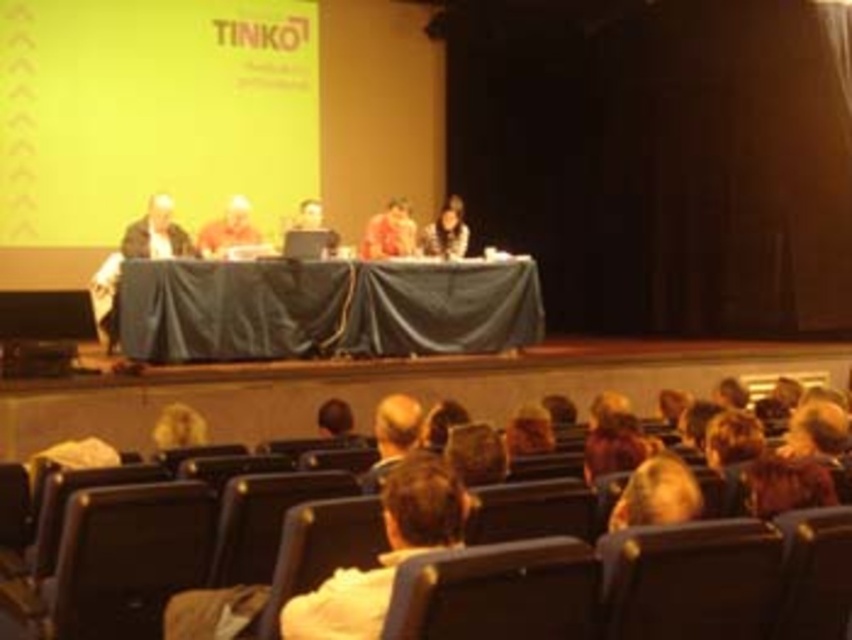
Question: Which point is closer to the camera?

Choices:
 (A) orange fabric at center
 (B) yellow matte projection screen at upper center
 (C) black leather chair at lower right
 (D) matte gold hair at center

Answer: (C)

Question: Which of the following is the farthest from the observer?

Choices:
 (A) matte black laptop at center
 (B) matte gold hair at center

Answer: (A)

Question: In this image, where is matte gold hair at center located relative to matte black laptop at center?

Choices:
 (A) above
 (B) below

Answer: (B)

Question: Which point is closer to the camera?

Choices:
 (A) yellow matte projection screen at upper center
 (B) matte gold hair at center
 (C) orange fabric at center
 (D) matte black laptop at center

Answer: (B)

Question: Considering the relative positions of yellow matte projection screen at upper center and black leather chair at lower right in the image provided, where is yellow matte projection screen at upper center located with respect to black leather chair at lower right?

Choices:
 (A) below
 (B) above

Answer: (B)

Question: Can you confirm if matte gold hair at center is positioned below matte black laptop at center?

Choices:
 (A) no
 (B) yes

Answer: (B)